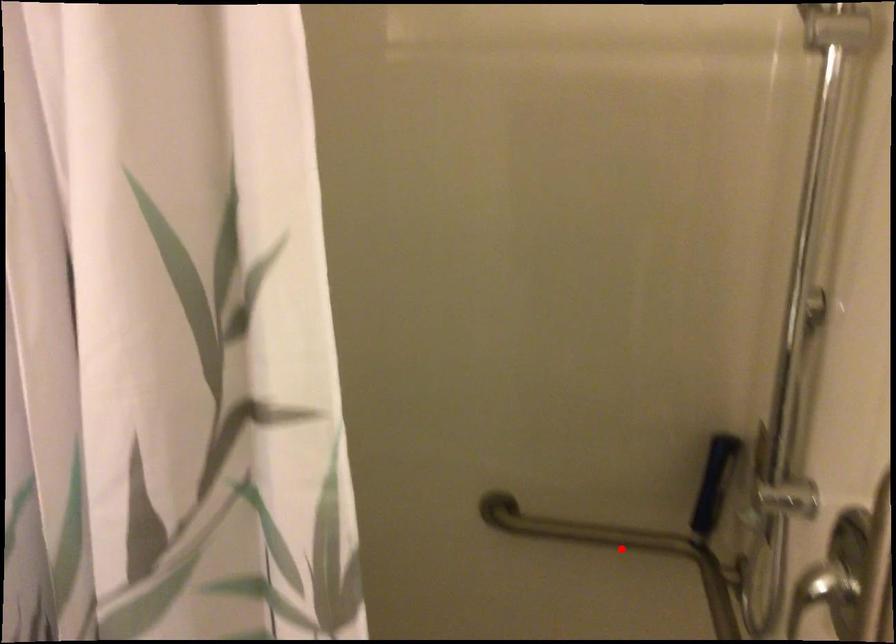
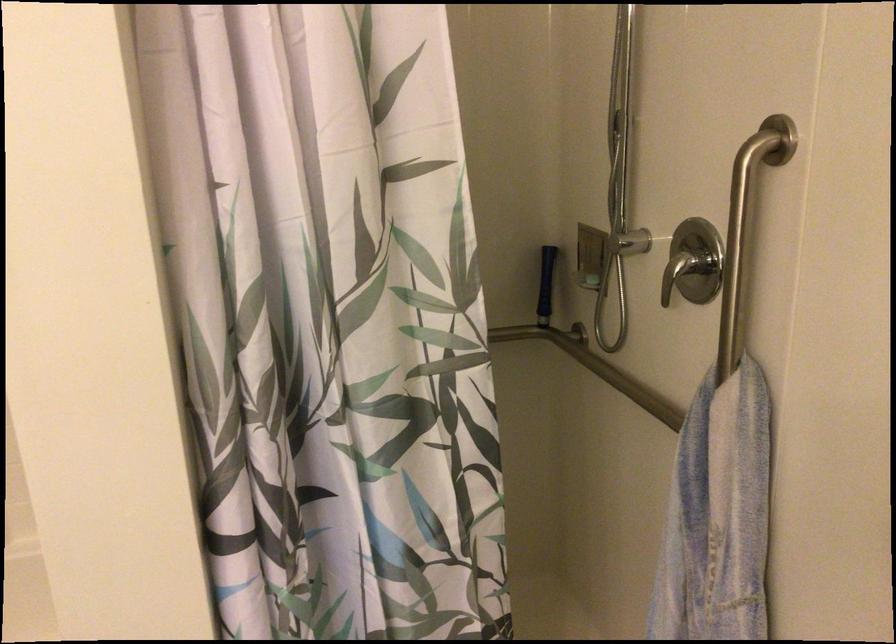
Question: I am providing you with two images of the same scene from different viewpoints. A red point is marked on the first image. At the location where the point appears in image 1, is it still visible in image 2?

Choices:
 (A) Yes
 (B) No

Answer: (B)